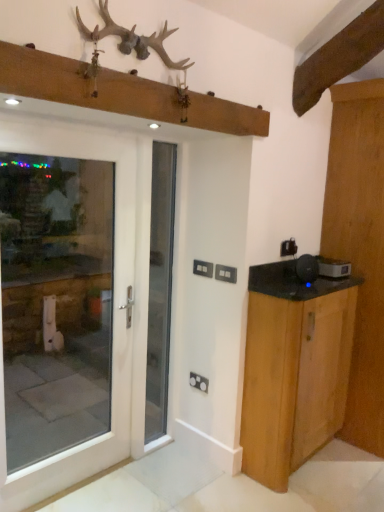
Find the location of a particular element. This screenshot has width=384, height=512. white glass door at center is located at coordinates (160, 288).

Where is `antlered wooden rack at upper center`? The image size is (384, 512). antlered wooden rack at upper center is located at coordinates (132, 38).

The height and width of the screenshot is (512, 384). I want to click on black plastic speaker at right, arranged as the second appliance when viewed from the left, so click(x=333, y=268).

At what (x,y) coordinates should I click in order to perform the action: click on white glass door at center. Please return your answer as a coordinate pair (x, y). Looking at the image, I should click on (160, 288).

Between light wood cabinet at right and black plastic speaker at right, which is the first appliance from right to left, which one appears on the right side from the viewer's perspective?

black plastic speaker at right, which is the first appliance from right to left, is more to the right.

From the image's perspective, would you say light wood cabinet at right is positioned over black plastic speaker at right, arranged as the second appliance when viewed from the left?

Incorrect, from the image's perspective, light wood cabinet at right is lower than black plastic speaker at right, arranged as the second appliance when viewed from the left.

Where is `the 1st appliance directly above the light wood cabinet at right (from a real-world perspective)`? Image resolution: width=384 pixels, height=512 pixels. the 1st appliance directly above the light wood cabinet at right (from a real-world perspective) is located at coordinates (333, 268).

Which is correct: light wood cabinet at right is inside black plastic speaker at right, which is the first appliance from back to front, or outside of it?

light wood cabinet at right is located beyond the bounds of black plastic speaker at right, which is the first appliance from back to front.

Would you say white glass door at center is outside black plastic speaker at right, which is the first appliance from back to front?

white glass door at center lies outside black plastic speaker at right, which is the first appliance from back to front,'s area.

Based on the photo, which object is positioned more to the right, white glass door at center or black plastic speaker at right, which is the first appliance from back to front?

black plastic speaker at right, which is the first appliance from back to front, is more to the right.

From the image's perspective, does white glass door at center appear higher than black plastic speaker at right, the 2th appliance viewed from the front?

No, from the image's perspective, white glass door at center is not over black plastic speaker at right, the 2th appliance viewed from the front.

Is white glass door at center further to camera compared to black plastic speaker at right, arranged as the second appliance when viewed from the left?

No, the depth of white glass door at center is less than that of black plastic speaker at right, arranged as the second appliance when viewed from the left.

Who is shorter, black plastic speaker at right, the second appliance when ordered from back to front, or wooden cabinet at right, the 1th door positioned from the right?

black plastic speaker at right, the second appliance when ordered from back to front, is shorter.

From the image's perspective, would you say black plastic speaker at right, which is the 1th appliance in left-to-right order, is shown under wooden cabinet at right, the 1th door positioned from the right?

Yes, from the image's perspective, black plastic speaker at right, which is the 1th appliance in left-to-right order, is below wooden cabinet at right, the 1th door positioned from the right.

Is black plastic speaker at right, which is the 1th appliance in left-to-right order, smaller than wooden cabinet at right, the 1th door positioned from the right?

Yes, black plastic speaker at right, which is the 1th appliance in left-to-right order, is smaller than wooden cabinet at right, the 1th door positioned from the right.

Is antlered wooden rack at upper center facing away from white glass door at left, the second door viewed from the right?

antlered wooden rack at upper center does not have its back to white glass door at left, the second door viewed from the right.

Is antlered wooden rack at upper center outside of white glass door at left, which appears as the 1th door when viewed from the left?

antlered wooden rack at upper center is positioned outside white glass door at left, which appears as the 1th door when viewed from the left.

Based on the photo, how different are the orientations of antlered wooden rack at upper center and white glass door at left, which appears as the 1th door when viewed from the left, in degrees?

1.06 degrees.

Could you measure the distance between antlered wooden rack at upper center and white glass door at left, which appears as the 1th door when viewed from the left?

antlered wooden rack at upper center is 35.72 inches away from white glass door at left, which appears as the 1th door when viewed from the left.

Is point (180, 69) positioned in front of point (267, 438)?

That is True.

Is antlered wooden rack at upper center oriented away from light wood cabinet at right?

No, antlered wooden rack at upper center is not facing away from light wood cabinet at right.

Are antlered wooden rack at upper center and light wood cabinet at right beside each other?

antlered wooden rack at upper center and light wood cabinet at right are not in contact.

Is black plastic speaker at right, arranged as the second appliance when viewed from the left, further to the viewer compared to wooden cabinet at right, acting as the 1th door starting from the back?

Yes, the depth of black plastic speaker at right, arranged as the second appliance when viewed from the left, is greater than that of wooden cabinet at right, acting as the 1th door starting from the back.

Is wooden cabinet at right, which ranks as the second door in front-to-back order, at the back of black plastic speaker at right, arranged as the second appliance when viewed from the left?

No, black plastic speaker at right, arranged as the second appliance when viewed from the left, is not facing the opposite direction of wooden cabinet at right, which ranks as the second door in front-to-back order.

Is black plastic speaker at right, the 2th appliance viewed from the front, beside wooden cabinet at right, the 2th door positioned from the left?

No, black plastic speaker at right, the 2th appliance viewed from the front, is not in contact with wooden cabinet at right, the 2th door positioned from the left.

Is white glass door at left, which ranks as the first door in front-to-back order, at the back of black plastic speaker at right, which is the first appliance from right to left?

That's not correct — black plastic speaker at right, which is the first appliance from right to left, is not looking away from white glass door at left, which ranks as the first door in front-to-back order.

Considering the points (332, 270) and (129, 233), which point is in front, point (332, 270) or point (129, 233)?

The point (129, 233) is more forward.

From the image's perspective, which one is positioned higher, black plastic speaker at right, the 2th appliance viewed from the front, or white glass door at left, which ranks as the first door in front-to-back order?

From the image's view, black plastic speaker at right, the 2th appliance viewed from the front, is above.

Considering the relative sizes of black plastic speaker at right, arranged as the second appliance when viewed from the left, and white glass door at left, which ranks as the first door in front-to-back order, in the image provided, is black plastic speaker at right, arranged as the second appliance when viewed from the left, bigger than white glass door at left, which ranks as the first door in front-to-back order,?

Actually, black plastic speaker at right, arranged as the second appliance when viewed from the left, might be smaller than white glass door at left, which ranks as the first door in front-to-back order.

The height and width of the screenshot is (512, 384). Identify the location of cabinetry below the black plastic speaker at right, which is the first appliance from right to left (from a real-world perspective). (294, 369).

Image resolution: width=384 pixels, height=512 pixels. Find the location of `the 2nd appliance counting from the right side of the white glass door at center`. the 2nd appliance counting from the right side of the white glass door at center is located at coordinates 333,268.

In the scene shown: From the image, which object appears to be farther from wooden cabinet at right, acting as the 1th door starting from the back, antlered wooden rack at upper center or black plastic speaker at right, the 2th appliance viewed from the front?

The object further to wooden cabinet at right, acting as the 1th door starting from the back, is antlered wooden rack at upper center.

When comparing their distances from wooden cabinet at right, acting as the 1th door starting from the back, does antlered wooden rack at upper center or white glass door at center seem further?

The object further to wooden cabinet at right, acting as the 1th door starting from the back, is antlered wooden rack at upper center.

Estimate the real-world distances between objects in this image. Which object is closer to black plastic speaker at right, which is the first appliance from back to front, antlered wooden rack at upper center or black plastic speaker at right, the 2th appliance in the right-to-left sequence?

The object closer to black plastic speaker at right, which is the first appliance from back to front, is black plastic speaker at right, the 2th appliance in the right-to-left sequence.

Considering their positions, is black plastic speaker at right, the second appliance when ordered from back to front, positioned further to white glass door at left, which appears as the 1th door when viewed from the left, than light wood cabinet at right?

Based on the image, black plastic speaker at right, the second appliance when ordered from back to front, appears to be further to white glass door at left, which appears as the 1th door when viewed from the left.

Which object lies further to the anchor point antlered wooden rack at upper center, black plastic speaker at right, which is the 1th appliance in left-to-right order, or light wood cabinet at right?

Based on the image, light wood cabinet at right appears to be further to antlered wooden rack at upper center.

Which object lies nearer to the anchor point antlered wooden rack at upper center, white glass door at center or light wood cabinet at right?

The object closer to antlered wooden rack at upper center is white glass door at center.

Looking at the image, which one is located further to antlered wooden rack at upper center, black plastic speaker at right, the 2th appliance in the right-to-left sequence, or wooden cabinet at right, which ranks as the second door in front-to-back order?

wooden cabinet at right, which ranks as the second door in front-to-back order.

When comparing their distances from black plastic speaker at right, the 1th appliance positioned from the front, does light wood cabinet at right or wooden cabinet at right, the 2th door positioned from the left, seem closer?

light wood cabinet at right lies closer to black plastic speaker at right, the 1th appliance positioned from the front, than the other object.

The image size is (384, 512). I want to click on cabinetry located between antlered wooden rack at upper center and wooden cabinet at right, the 1th door positioned from the right, in the left-right direction, so click(x=294, y=369).

Where is `screen door between antlered wooden rack at upper center and light wood cabinet at right from top to bottom`? The width and height of the screenshot is (384, 512). screen door between antlered wooden rack at upper center and light wood cabinet at right from top to bottom is located at coordinates point(160,288).

Image resolution: width=384 pixels, height=512 pixels. I want to click on screen door situated between white glass door at left, the second door viewed from the right, and black plastic speaker at right, which is the first appliance from right to left, from left to right, so click(160, 288).

The height and width of the screenshot is (512, 384). In order to click on appliance situated between white glass door at center and black plastic speaker at right, which is the first appliance from back to front, from left to right in this screenshot , I will do click(x=307, y=269).